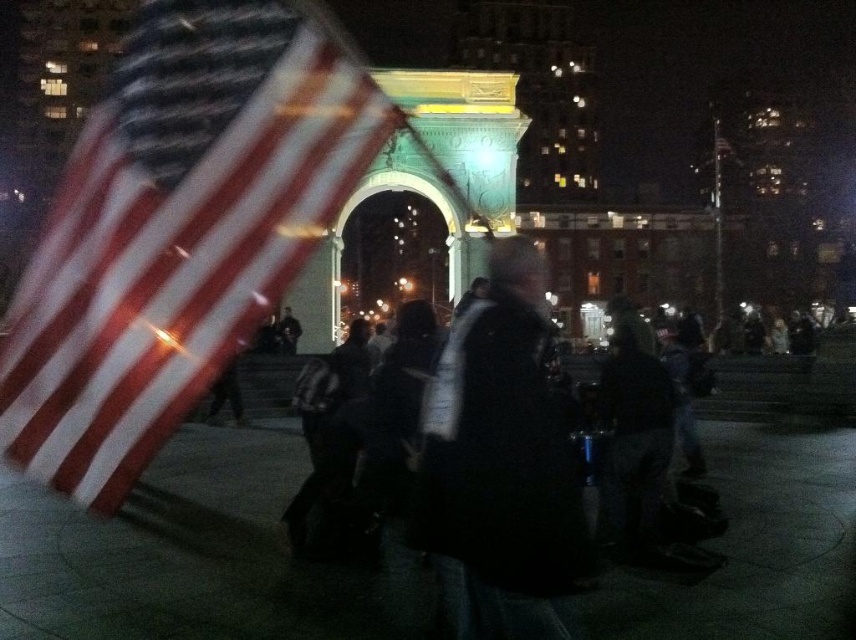
Question: Which object is closer to the camera taking this photo?

Choices:
 (A) dark gray jacket at center
 (B) matte fabric flag at left
 (C) black matte jacket at center

Answer: (C)

Question: Which of these objects is positioned farthest from the dark gray jacket at center?

Choices:
 (A) black matte jacket at center
 (B) matte fabric flag at left

Answer: (B)

Question: Is dark gray jacket at center to the left of black matte jacket at center from the viewer's perspective?

Choices:
 (A) yes
 (B) no

Answer: (B)

Question: Can you confirm if matte fabric flag at left is positioned above dark gray jacket at center?

Choices:
 (A) no
 (B) yes

Answer: (B)

Question: Can you confirm if matte fabric flag at left is positioned above black matte jacket at center?

Choices:
 (A) no
 (B) yes

Answer: (B)

Question: Which of the following is the closest to the observer?

Choices:
 (A) matte fabric flag at left
 (B) dark gray jacket at center
 (C) black matte jacket at center

Answer: (C)